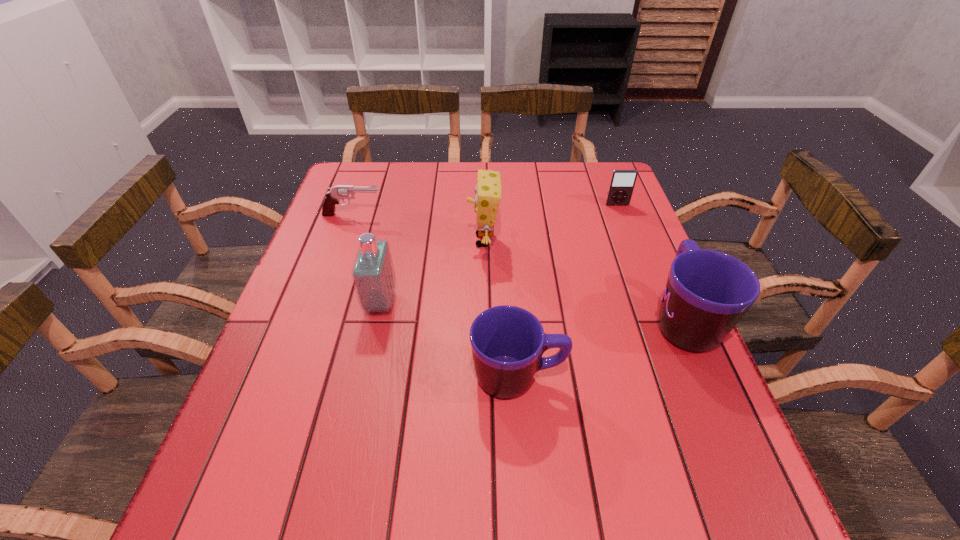
This screenshot has height=540, width=960. Identify the location of empty location between the leftmost object and the taller mug. (517, 267).

This screenshot has width=960, height=540. I want to click on free space between the taller mug and the iPod, so click(650, 262).

You are a GUI agent. You are given a task and a screenshot of the screen. Output one action in this format:
    pyautogui.click(x=<x>, y=<y>)
    Task: Click on the empty space that is in between the sponge and the taller mug
    This screenshot has height=540, width=960.
    Given the screenshot: What is the action you would take?
    [584, 280]

Find the location of a particular element. This screenshot has width=960, height=540. blank region between the right mug and the fourth tallest object is located at coordinates (600, 349).

The width and height of the screenshot is (960, 540). Identify the location of unoccupied position between the taller mug and the shorter mug. (600, 349).

Locate which object ranks third in proximity to the sponge. Please provide its 2D coordinates. Your answer should be formatted as a tuple, i.e. [(x, y)], where the tuple contains the x and y coordinates of a point satisfying the conditions above.

[(342, 192)]

I want to click on the closest object to the perfume, so click(x=488, y=192).

You are a GUI agent. You are given a task and a screenshot of the screen. Output one action in this format:
    pyautogui.click(x=<x>, y=<y>)
    Task: Click on the free space that satisfies the following two spatial constraints: 1. with the handle on the side of the right mug; 2. at the muzzle of the leftmost object
    This screenshot has width=960, height=540.
    Given the screenshot: What is the action you would take?
    pyautogui.click(x=637, y=215)

Locate an element on the screen. free space that satisfies the following two spatial constraints: 1. on the face of the sponge; 2. with the handle on the side of the taller mug is located at coordinates (484, 320).

The image size is (960, 540). I want to click on vacant area that satisfies the following two spatial constraints: 1. on the face of the sponge; 2. with the handle on the side of the taller mug, so click(x=484, y=320).